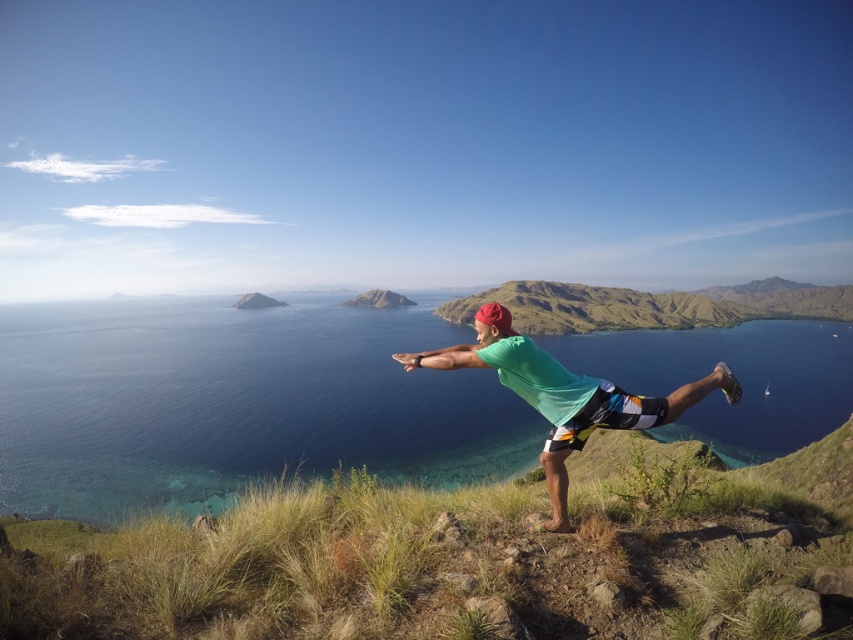
Between point (810, 541) and point (218, 301), which one is positioned behind?

Positioned behind is point (218, 301).

Does green grassy hillside at center have a lesser height compared to clear blue water at center?

Yes.

Describe the element at coordinates (461, 556) in the screenshot. I see `green grassy hillside at center` at that location.

Where is `green grassy hillside at center`? green grassy hillside at center is located at coordinates (461, 556).

Is point (248, 376) positioned in front of point (482, 323)?

That is False.

Is point (193, 499) positioned before point (476, 310)?

Yes, point (193, 499) is closer to viewer.

Locate an element on the screen. This screenshot has width=853, height=640. clear blue water at center is located at coordinates (236, 403).

Between clear blue water at center and multicolored woven shorts at center, which one has less height?

Standing shorter between the two is multicolored woven shorts at center.

Image resolution: width=853 pixels, height=640 pixels. I want to click on clear blue water at center, so click(236, 403).